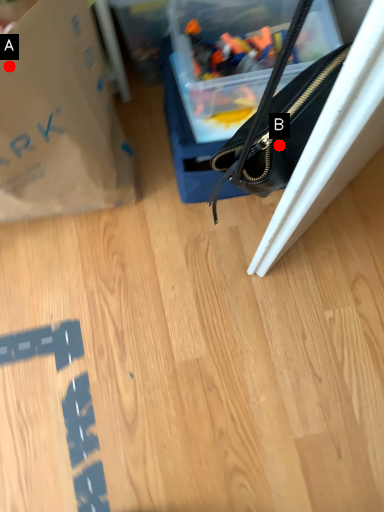
Question: Two points are circled on the image, labeled by A and B beside each circle. Among these points, which one is nearest to the camera?

Choices:
 (A) A is closer
 (B) B is closer

Answer: (B)